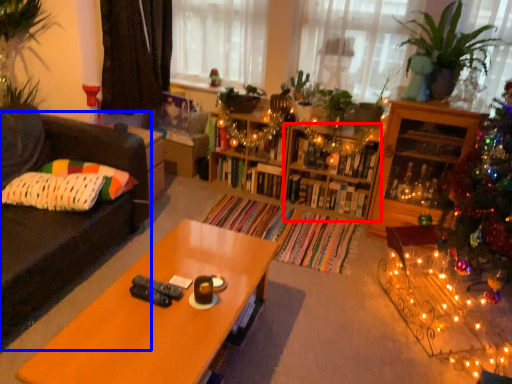
Question: Which of the following is the farthest to the observer, shelf (highlighted by a red box) or studio couch (highlighted by a blue box)?

Choices:
 (A) shelf
 (B) studio couch

Answer: (A)